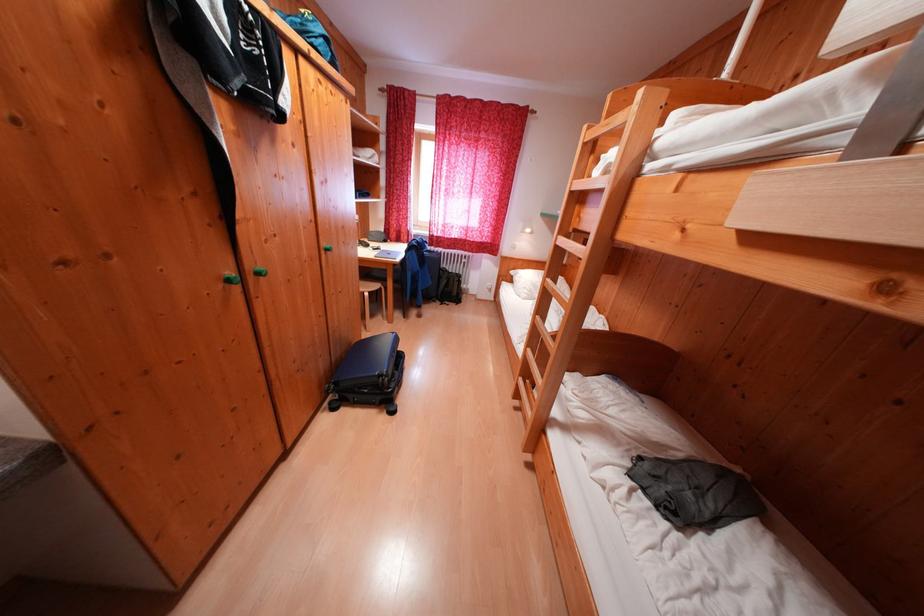
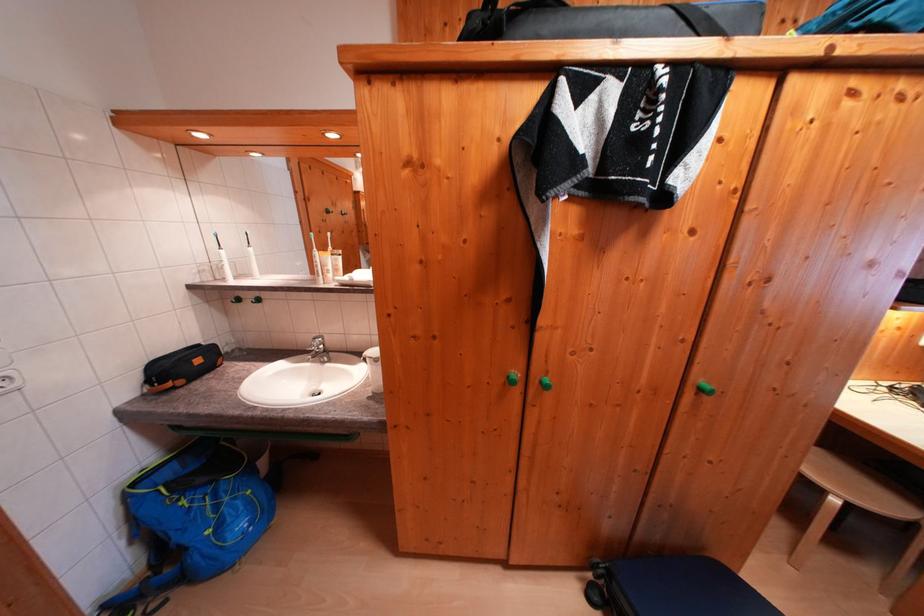
In the second image, find the point that corresponds to point 265,277 in the first image.

(550, 387)